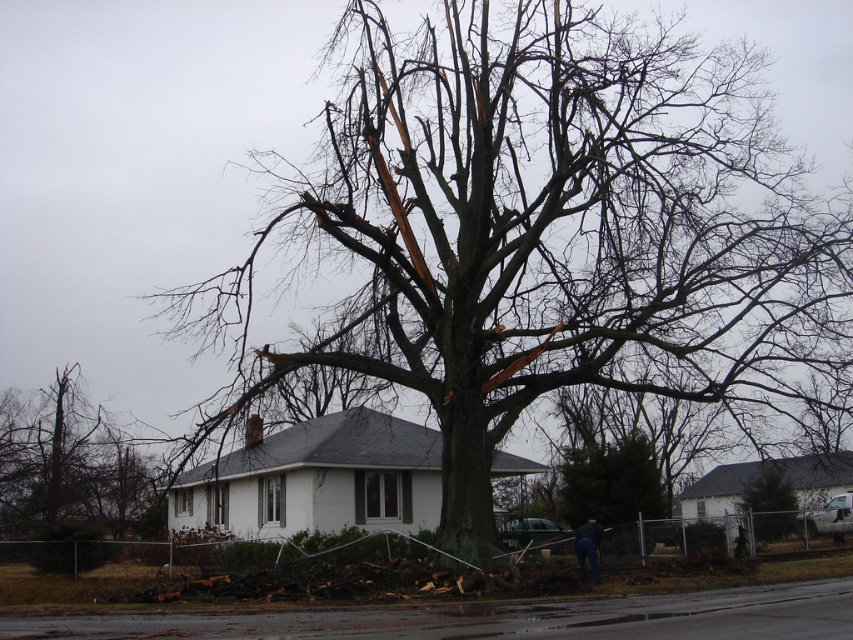
Question: Is green textured tree at center in front of dark blue jeans at lower center?

Choices:
 (A) no
 (B) yes

Answer: (A)

Question: Which point is closer to the camera taking this photo?

Choices:
 (A) (598, 529)
 (B) (61, 392)
 (C) (746, 490)
 (D) (602, 488)

Answer: (A)

Question: Is green textured tree at center above brown rough bark tree at center?

Choices:
 (A) no
 (B) yes

Answer: (A)

Question: Which object is positioned farthest from the brown bark tree at left?

Choices:
 (A) dark blue jeans at lower center
 (B) green textured tree at center

Answer: (A)

Question: Which point is closer to the camera?

Choices:
 (A) brown bark tree at left
 (B) dark blue jeans at lower center

Answer: (B)

Question: Is brown bark tree at left smaller than dark blue jeans at lower center?

Choices:
 (A) yes
 (B) no

Answer: (B)